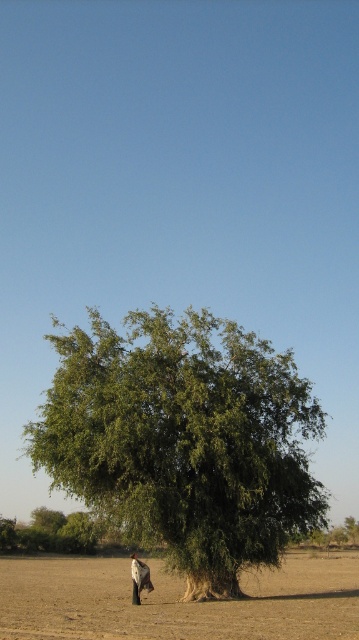
You are a hiker who has just set up camp in the field. Your tent is represented by the dark brown fur at lower center. You want to secure your tent to the green leafy tree at center for stability. Do you have enough rope that is 6 meters long to tie between them?

The distance between the green leafy tree at center and the dark brown fur at lower center is 6.18 meters. Since the rope is only 6 meters long, it is 0.18 meters shorter than needed. Therefore, the rope is insufficient to securely tie between them.

You are standing in the field and want to take a photo of the green leafy tree at center. If your camera has a maximum focus range of 25 meters, will it be able to focus on the tree?

The green leafy tree at center is 24.86 meters away from the viewer. Since the camera can focus up to 25 meters, it will be able to focus on the tree.

You are a surveyor measuring distances in the field. You have a measuring tape that can extend up to 30 feet. You need to measure the distance between the green leafy tree at center and the brown sandy dirt at lower center. Can your measuring tape reach that distance?

The green leafy tree at center is 32.77 feet from the brown sandy dirt at lower center. Since the measuring tape can only extend up to 30 feet, it cannot reach the required distance.